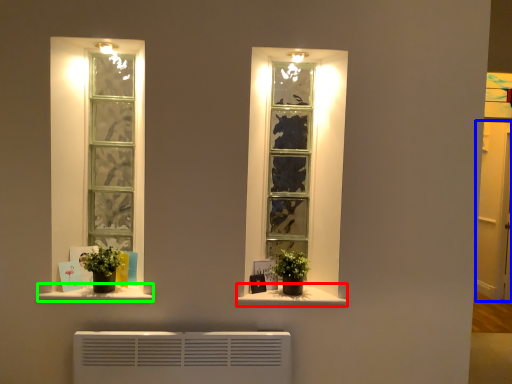
Question: Which object is the closest to the window sill (highlighted by a red box)? Choose among these: glass door (highlighted by a blue box) or window sill (highlighted by a green box).

Choices:
 (A) glass door
 (B) window sill

Answer: (B)